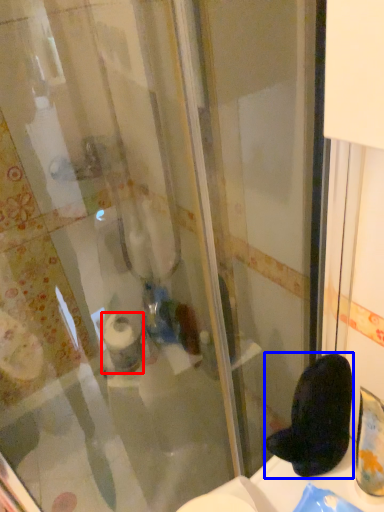
Question: Which object is further to the camera taking this photo, toilet paper (highlighted by a red box) or footwear (highlighted by a blue box)?

Choices:
 (A) toilet paper
 (B) footwear

Answer: (A)